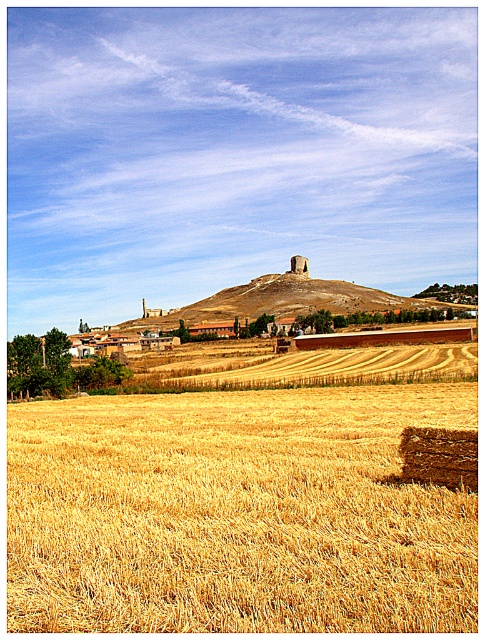
Question: Which point is closer to the camera?

Choices:
 (A) (74, 580)
 (B) (236, 385)

Answer: (A)

Question: Which object appears farthest from the camera in this image?

Choices:
 (A) golden straw bale at center
 (B) golden straw bale at lower right
 (C) smooth beige hill at center

Answer: (C)

Question: Is golden straw bale at lower right positioned before golden straw bale at center?

Choices:
 (A) no
 (B) yes

Answer: (B)

Question: Does golden straw bale at lower right appear over golden straw bale at center?

Choices:
 (A) no
 (B) yes

Answer: (B)

Question: Which object appears farthest from the camera in this image?

Choices:
 (A) golden straw bale at center
 (B) golden straw bale at lower right

Answer: (A)

Question: Is the position of golden straw bale at lower right more distant than that of smooth beige hill at center?

Choices:
 (A) yes
 (B) no

Answer: (B)